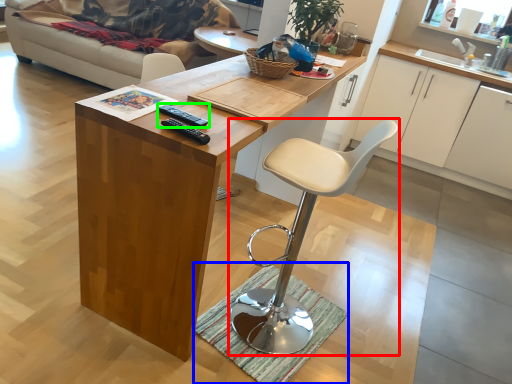
Question: Estimate the real-world distances between objects in this image. Which object is farther from chair (highlighted by a red box), doormat (highlighted by a blue box) or remote (highlighted by a green box)?

Choices:
 (A) doormat
 (B) remote

Answer: (B)